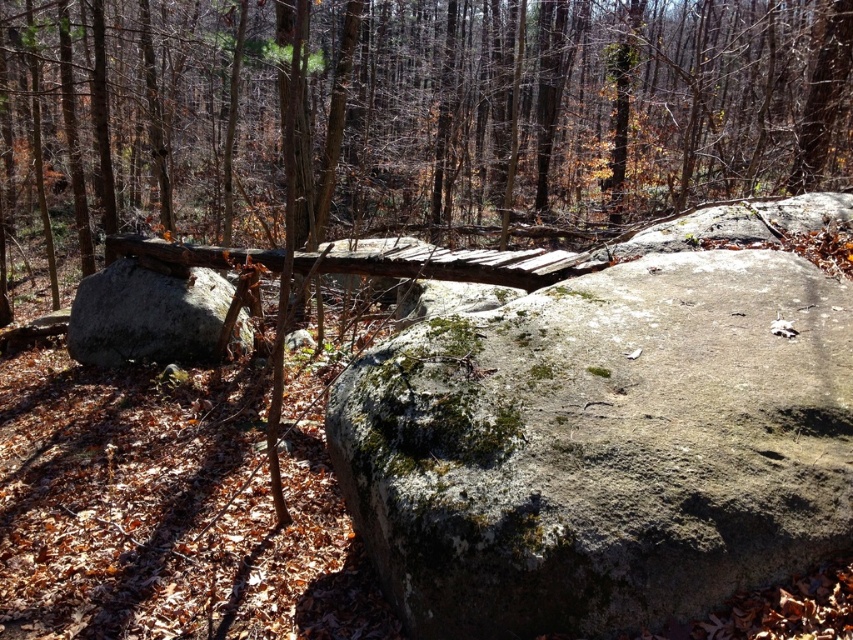
Which is more to the right, gray mossy rock at left or brown wooden bridge at center?

brown wooden bridge at center

Between gray mossy rock at left and brown wooden bridge at center, which one has more height?

gray mossy rock at left is taller.

At what (x,y) coordinates should I click in order to perform the action: click on gray mossy rock at left. Please return your answer as a coordinate pair (x, y). This screenshot has height=640, width=853. Looking at the image, I should click on (146, 316).

Is brown rough log at center below brown wooden bridge at center?

No.

Does brown rough log at center have a smaller size compared to brown wooden bridge at center?

No, brown rough log at center is not smaller than brown wooden bridge at center.

Is point (672, 204) positioned behind point (492, 272)?

Yes, it is behind point (492, 272).

The image size is (853, 640). Find the location of `brown rough log at center`. brown rough log at center is located at coordinates (567, 108).

Is green mossy rock at center closer to camera compared to gray mossy rock at left?

Yes, green mossy rock at center is closer to the viewer.

Between green mossy rock at center and gray mossy rock at left, which one appears on the right side from the viewer's perspective?

green mossy rock at center

Who is more forward, (x=485, y=420) or (x=97, y=289)?

Positioned in front is point (x=485, y=420).

Locate an element on the screen. The height and width of the screenshot is (640, 853). green mossy rock at center is located at coordinates (602, 445).